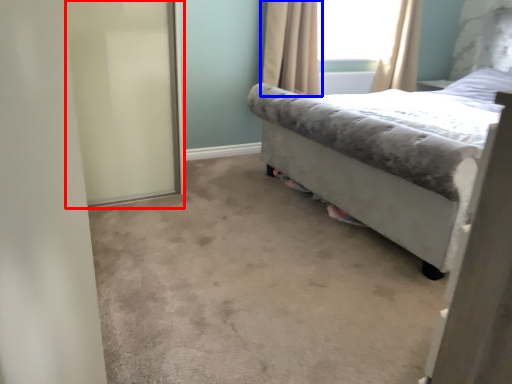
Question: Which point is closer to the camera, screen door (highlighted by a red box) or curtain (highlighted by a blue box)?

Choices:
 (A) screen door
 (B) curtain

Answer: (A)